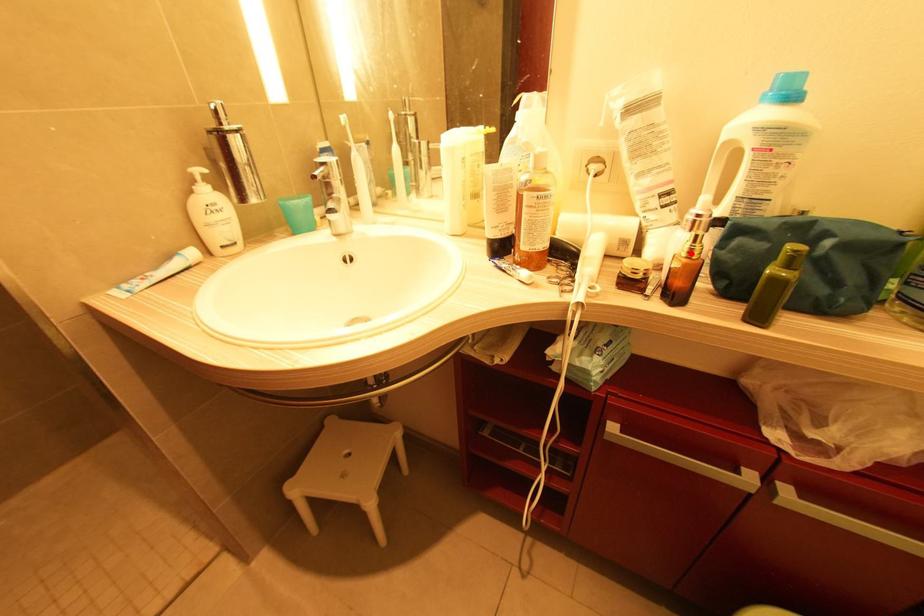
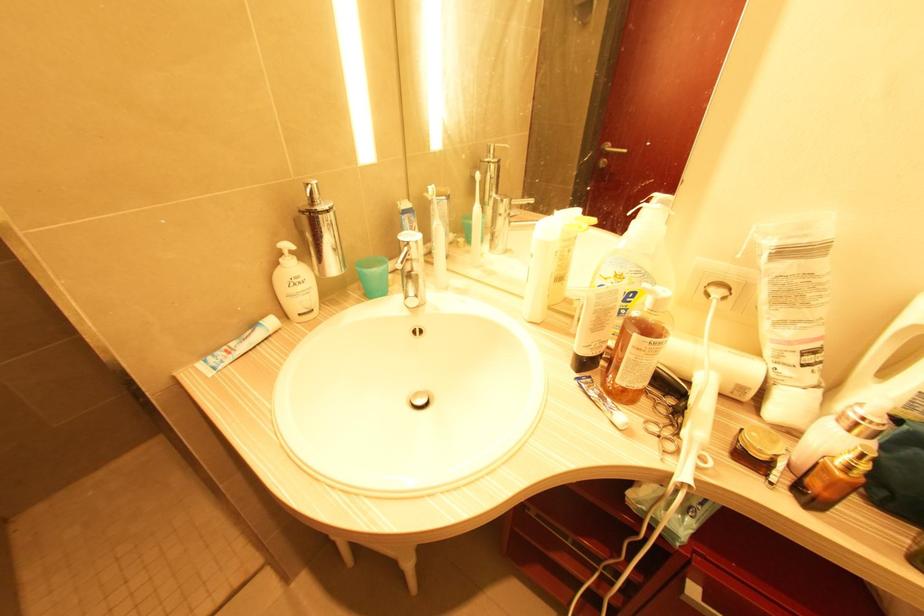
The point at the highlighted location is marked in the first image. Where is the corresponding point in the second image?

(850, 468)